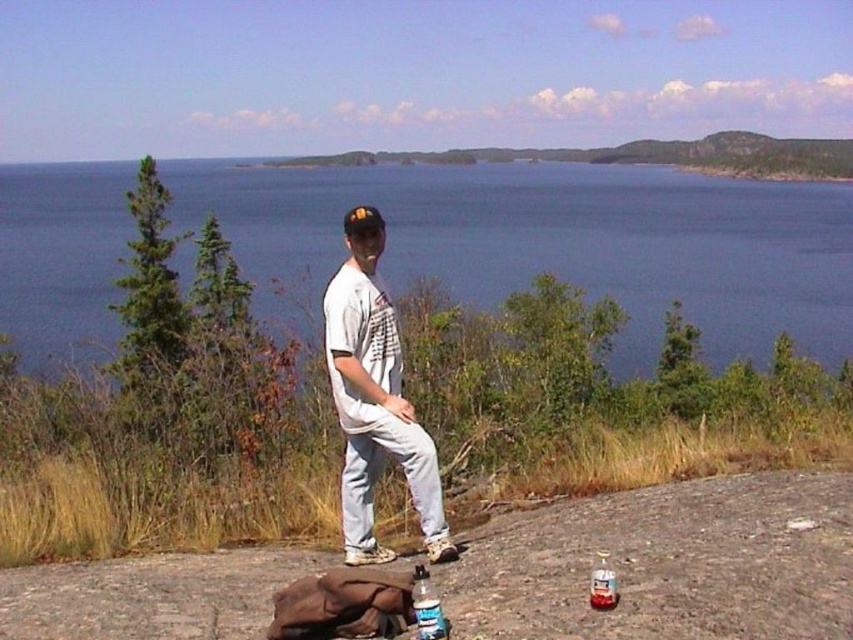
You are a hiker who wants to take a photo of the blue water at center and the clear plastic bottle at lower right. Which object should you focus on first if you want to capture both in a single shot without moving the camera?

The blue water at center is located above the clear plastic bottle at lower right, so you should focus on the clear plastic bottle at lower right first since it is closer to the camera and part of the foreground, ensuring both objects are in focus.

You are standing at the point closer to the viewer in the image. You want to walk towards the distant hills or islands in the background. Which direction should you move relative to the two points, point (341, 396) and point (422, 618)?

You should move away from point (341, 396) and towards point (422, 618) because point (341, 396) is closer to you, while point (422, 618) is further away towards the background where the distant hills or islands are located.